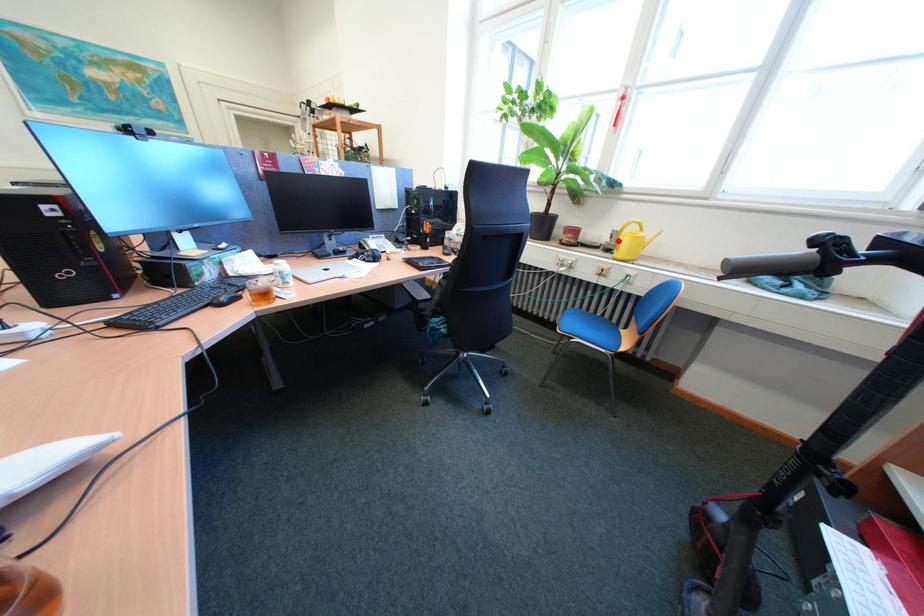
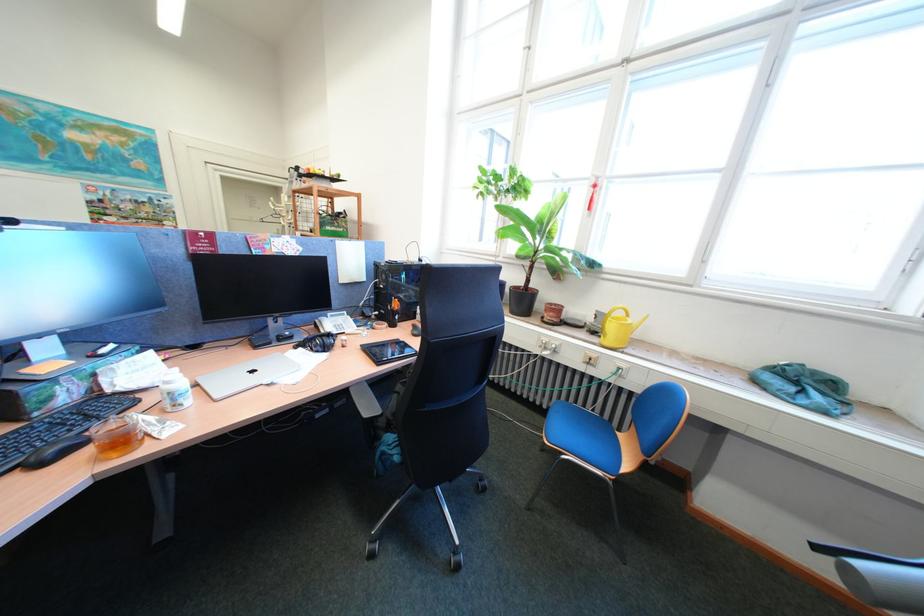
The point at the highlighted location is marked in the first image. Where is the corresponding point in the second image?

(602, 321)